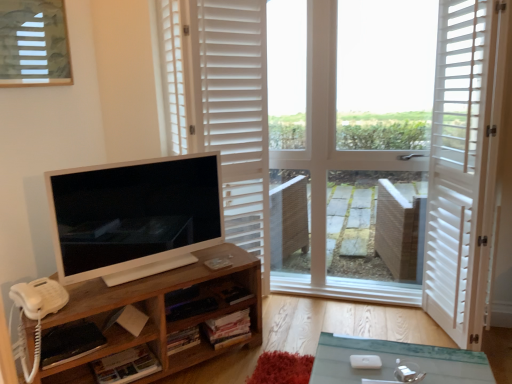
Question: Can you confirm if satin white monitor at left is thinner than white matte shutters at upper center?

Choices:
 (A) yes
 (B) no

Answer: (A)

Question: Is satin white monitor at left facing away from white matte shutters at upper center?

Choices:
 (A) yes
 (B) no

Answer: (A)

Question: Does satin white monitor at left have a larger size compared to white matte shutters at upper center?

Choices:
 (A) yes
 (B) no

Answer: (B)

Question: From a real-world perspective, is satin white monitor at left positioned over white matte shutters at upper center based on gravity?

Choices:
 (A) no
 (B) yes

Answer: (A)

Question: Would you say white matte shutters at upper center is part of satin white monitor at left's contents?

Choices:
 (A) yes
 (B) no

Answer: (B)

Question: Does point (64, 377) appear closer or farther from the camera than point (431, 145)?

Choices:
 (A) farther
 (B) closer

Answer: (B)

Question: In the image, is woodenobject at left positioned in front of or behind white wooden screen door at right?

Choices:
 (A) behind
 (B) front

Answer: (B)

Question: In terms of size, does woodenobject at left appear bigger or smaller than white wooden screen door at right?

Choices:
 (A) small
 (B) big

Answer: (A)

Question: From a real-world perspective, is woodenobject at left physically located above or below white wooden screen door at right?

Choices:
 (A) above
 (B) below

Answer: (B)

Question: Considering their positions, is woodenobject at left located in front of or behind white matte shutters at upper center?

Choices:
 (A) behind
 (B) front

Answer: (B)

Question: Is woodenobject at left to the left or to the right of white matte shutters at upper center in the image?

Choices:
 (A) right
 (B) left

Answer: (B)

Question: From the image's perspective, is woodenobject at left located above or below white matte shutters at upper center?

Choices:
 (A) above
 (B) below

Answer: (B)

Question: In terms of size, does woodenobject at left appear bigger or smaller than white matte shutters at upper center?

Choices:
 (A) big
 (B) small

Answer: (B)

Question: Visually, is matte glass window at upper left positioned to the left or to the right of woodenobject at left?

Choices:
 (A) left
 (B) right

Answer: (A)

Question: Considering the positions of point (66, 51) and point (256, 334), is point (66, 51) closer or farther from the camera than point (256, 334)?

Choices:
 (A) closer
 (B) farther

Answer: (B)